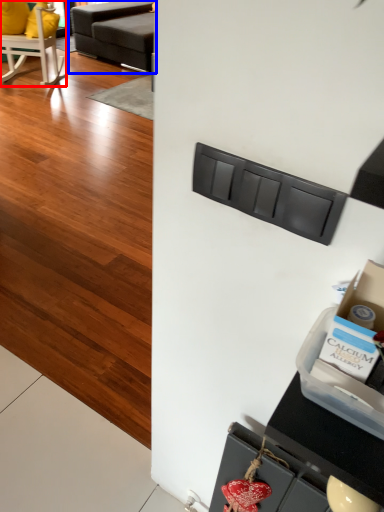
Question: Which point is further to the camera, chair (highlighted by a red box) or studio couch (highlighted by a blue box)?

Choices:
 (A) chair
 (B) studio couch

Answer: (B)